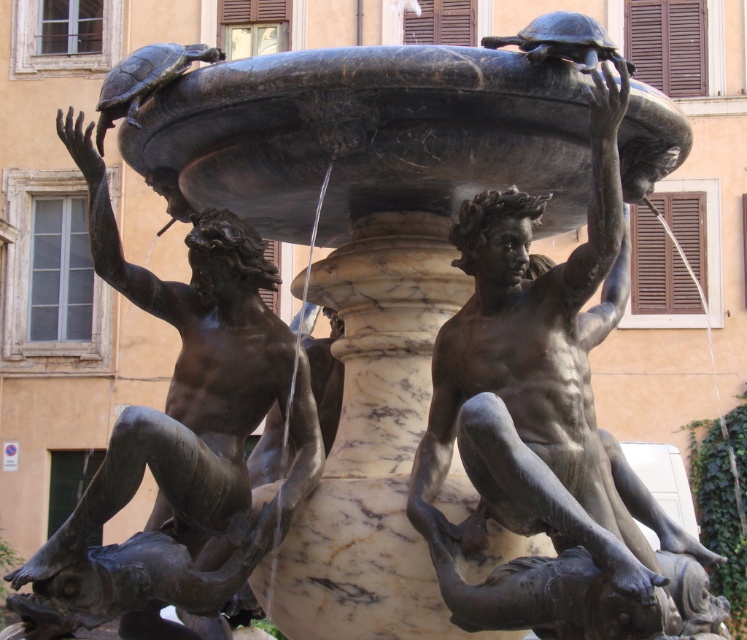
Question: Can you confirm if bronze statue at center is thinner than bronze statue at left?

Choices:
 (A) yes
 (B) no

Answer: (A)

Question: Which object appears closest to the camera in this image?

Choices:
 (A) bronze statue at left
 (B) bronze statue at center

Answer: (B)

Question: Is bronze statue at center further to camera compared to bronze statue at left?

Choices:
 (A) no
 (B) yes

Answer: (A)

Question: Does bronze statue at center have a lesser width compared to bronze statue at left?

Choices:
 (A) no
 (B) yes

Answer: (B)

Question: Which of the following is the closest to the observer?

Choices:
 (A) (31, 592)
 (B) (580, 358)

Answer: (A)

Question: Which of the following is the closest to the observer?

Choices:
 (A) (192, 433)
 (B) (489, 604)

Answer: (B)